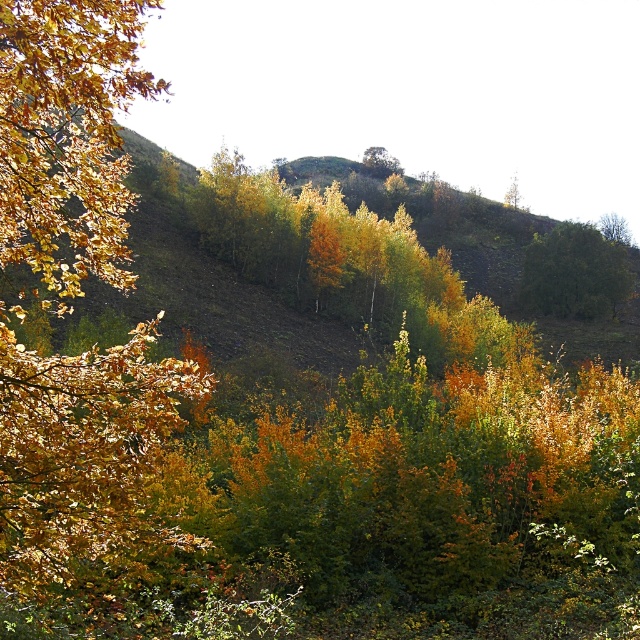
Question: Is the position of green leafy tree at center less distant than that of green matte tree at upper right?

Choices:
 (A) yes
 (B) no

Answer: (A)

Question: Among these objects, which one is nearest to the camera?

Choices:
 (A) golden leafy branch at left
 (B) green leafy tree at center

Answer: (A)

Question: Among these objects, which one is nearest to the camera?

Choices:
 (A) golden leafy branch at left
 (B) green leafy tree at center

Answer: (A)

Question: Which object is positioned farthest from the green matte tree at upper right?

Choices:
 (A) golden leafy branch at left
 (B) green leafy tree at center

Answer: (A)

Question: Can you confirm if golden leafy branch at left is positioned below green matte tree at upper right?

Choices:
 (A) no
 (B) yes

Answer: (B)

Question: Does golden leafy branch at left have a larger size compared to green matte tree at upper right?

Choices:
 (A) yes
 (B) no

Answer: (A)